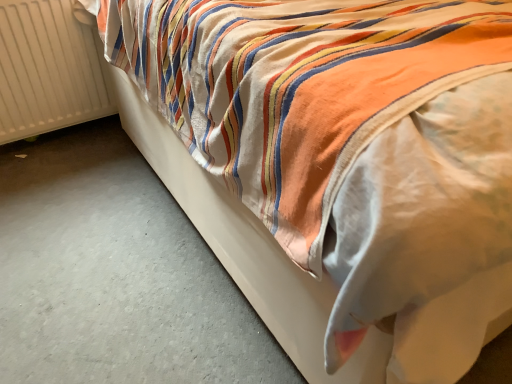
Question: Considering the relative sizes of white smooth concrete at lower left and white ribbed radiator at left in the image provided, is white smooth concrete at lower left shorter than white ribbed radiator at left?

Choices:
 (A) no
 (B) yes

Answer: (B)

Question: Is white smooth concrete at lower left positioned beyond the bounds of white ribbed radiator at left?

Choices:
 (A) yes
 (B) no

Answer: (A)

Question: Considering the relative sizes of white smooth concrete at lower left and white ribbed radiator at left in the image provided, is white smooth concrete at lower left wider than white ribbed radiator at left?

Choices:
 (A) yes
 (B) no

Answer: (A)

Question: Does white smooth concrete at lower left come in front of white ribbed radiator at left?

Choices:
 (A) no
 (B) yes

Answer: (B)

Question: Is white smooth concrete at lower left placed right next to white ribbed radiator at left?

Choices:
 (A) no
 (B) yes

Answer: (A)

Question: From the image's perspective, is white smooth concrete at lower left on top of white ribbed radiator at left?

Choices:
 (A) no
 (B) yes

Answer: (A)

Question: Is white ribbed radiator at left positioned with its back to white smooth concrete at lower left?

Choices:
 (A) no
 (B) yes

Answer: (A)

Question: Does white ribbed radiator at left touch white smooth concrete at lower left?

Choices:
 (A) yes
 (B) no

Answer: (B)

Question: From a real-world perspective, is white ribbed radiator at left beneath white smooth concrete at lower left?

Choices:
 (A) yes
 (B) no

Answer: (B)

Question: Is white ribbed radiator at left bigger than white smooth concrete at lower left?

Choices:
 (A) no
 (B) yes

Answer: (A)

Question: From the image's perspective, is white ribbed radiator at left above white smooth concrete at lower left?

Choices:
 (A) yes
 (B) no

Answer: (A)

Question: Is white ribbed radiator at left smaller than white smooth concrete at lower left?

Choices:
 (A) no
 (B) yes

Answer: (B)

Question: Based on their positions, is white ribbed radiator at left located to the left or right of white smooth concrete at lower left?

Choices:
 (A) right
 (B) left

Answer: (B)